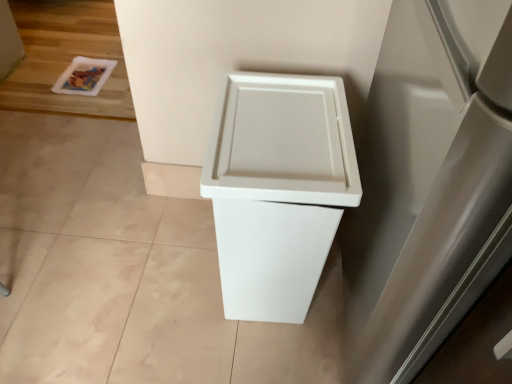
You are a GUI agent. You are given a task and a screenshot of the screen. Output one action in this format:
    pyautogui.click(x=<x>, y=<y>)
    Task: Click on the vacant space to the left of white plastic waste bin at center
    This screenshot has height=384, width=512.
    Given the screenshot: What is the action you would take?
    pyautogui.click(x=163, y=271)